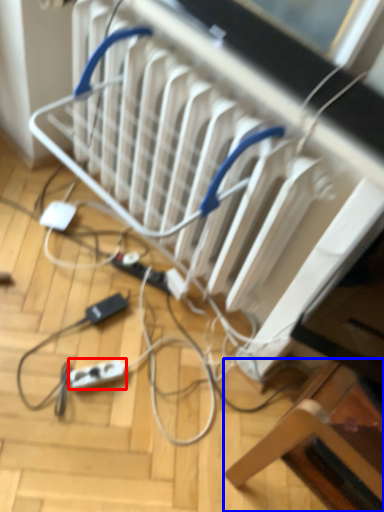
Question: Which object appears farthest to the camera in this image, extension cord (highlighted by a red box) or furniture (highlighted by a blue box)?

Choices:
 (A) extension cord
 (B) furniture

Answer: (A)